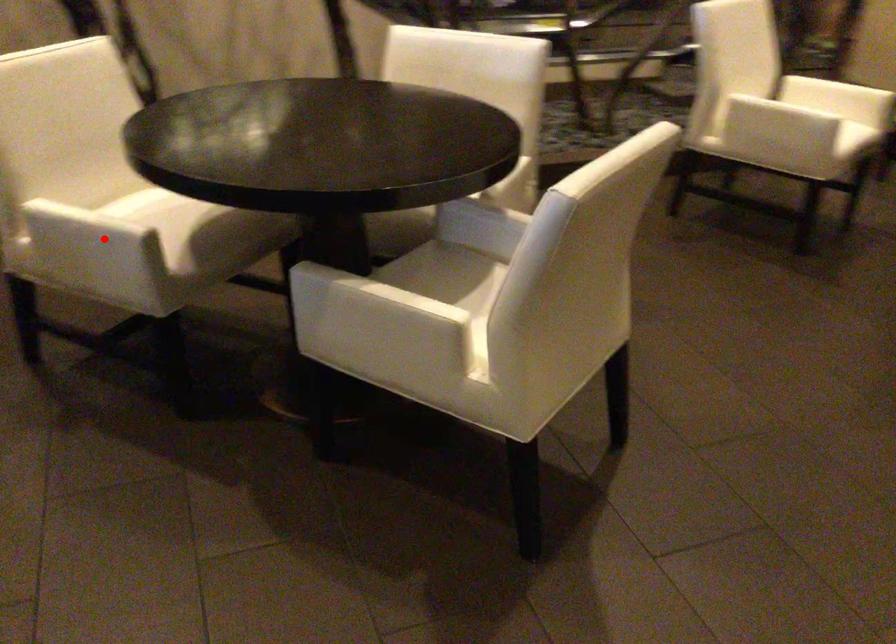
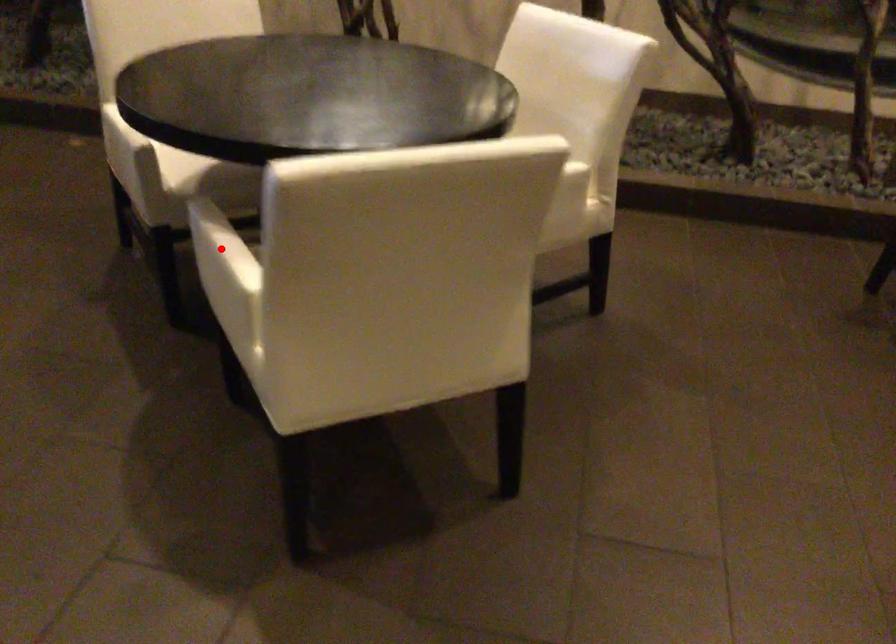
I am providing you with two images of the same scene from different viewpoints. A red point is marked on the first image and another point is marked on the second image. Does the point marked in image1 correspond to the same location as the one in image2?

No